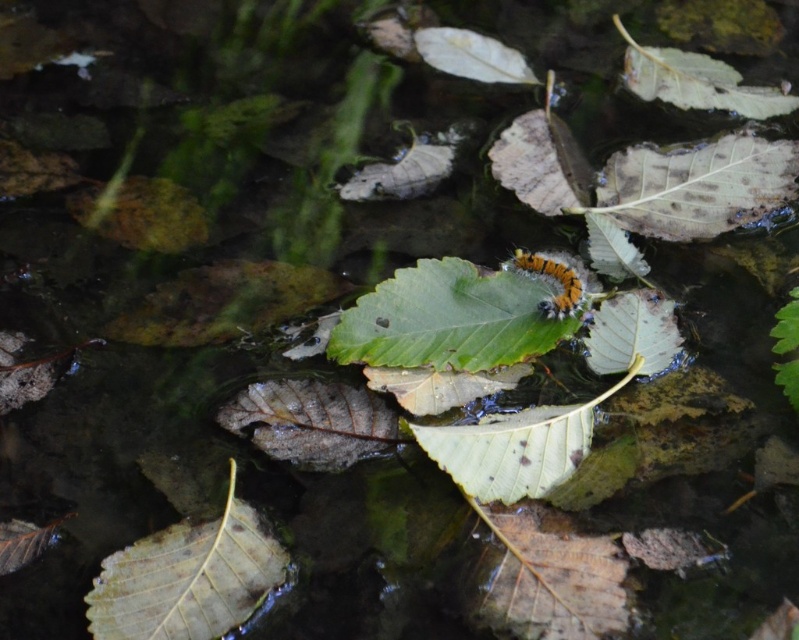
Question: Which object is closer to the camera taking this photo?

Choices:
 (A) green matte leaf at center
 (B) green matte leaf at lower left
 (C) tiger-striped fuzzy caterpillar at center

Answer: (B)

Question: Observing the image, what is the correct spatial positioning of green matte leaf at center in reference to tiger-striped fuzzy caterpillar at center?

Choices:
 (A) left
 (B) right

Answer: (A)

Question: Is green matte leaf at lower left further to the viewer compared to tiger-striped fuzzy caterpillar at center?

Choices:
 (A) no
 (B) yes

Answer: (A)

Question: From the image, what is the correct spatial relationship of green matte leaf at lower left in relation to tiger-striped fuzzy caterpillar at center?

Choices:
 (A) left
 (B) right

Answer: (A)

Question: Among these points, which one is farthest from the camera?

Choices:
 (A) (493, 308)
 (B) (94, 620)
 (C) (561, 308)

Answer: (A)

Question: Considering the real-world distances, which object is closest to the green matte leaf at center?

Choices:
 (A) tiger-striped fuzzy caterpillar at center
 (B) green matte leaf at lower left

Answer: (A)